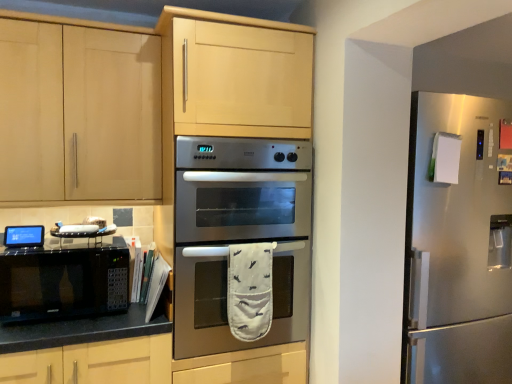
Question: Is satin silver refrigerator at right at the right side of black matte microwave at lower left?

Choices:
 (A) yes
 (B) no

Answer: (A)

Question: Could you tell me if satin silver refrigerator at right is turned towards black matte microwave at lower left?

Choices:
 (A) yes
 (B) no

Answer: (B)

Question: Considering the relative sizes of satin silver refrigerator at right and black matte microwave at lower left in the image provided, is satin silver refrigerator at right shorter than black matte microwave at lower left?

Choices:
 (A) no
 (B) yes

Answer: (A)

Question: Does satin silver refrigerator at right touch black matte microwave at lower left?

Choices:
 (A) no
 (B) yes

Answer: (A)

Question: From the image's perspective, does satin silver refrigerator at right appear lower than black matte microwave at lower left?

Choices:
 (A) yes
 (B) no

Answer: (A)

Question: From a real-world perspective, is satin silver refrigerator at right physically below black matte microwave at lower left?

Choices:
 (A) yes
 (B) no

Answer: (A)

Question: Does matte wood cabinet at upper left come in front of black matte microwave at lower left?

Choices:
 (A) no
 (B) yes

Answer: (A)

Question: Is matte wood cabinet at upper left looking in the opposite direction of black matte microwave at lower left?

Choices:
 (A) no
 (B) yes

Answer: (A)

Question: Does matte wood cabinet at upper left appear on the right side of black matte microwave at lower left?

Choices:
 (A) no
 (B) yes

Answer: (A)

Question: Can you confirm if matte wood cabinet at upper left is taller than black matte microwave at lower left?

Choices:
 (A) no
 (B) yes

Answer: (B)

Question: Can you confirm if matte wood cabinet at upper left is positioned to the left of black matte microwave at lower left?

Choices:
 (A) no
 (B) yes

Answer: (B)

Question: Are matte wood cabinet at upper left and black matte microwave at lower left far apart?

Choices:
 (A) no
 (B) yes

Answer: (A)

Question: Is satin silver refrigerator at right wider than stainless steel oven at center?

Choices:
 (A) no
 (B) yes

Answer: (B)